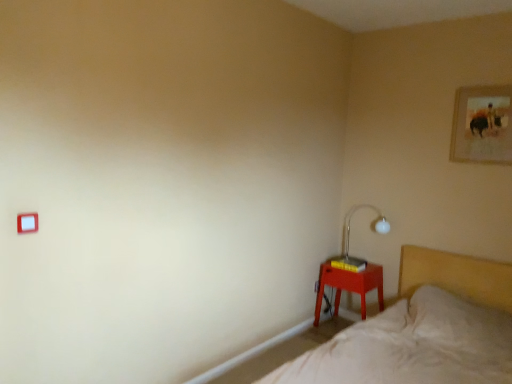
I want to click on beige fabric bed at lower right, so click(x=423, y=329).

What is the approximate height of white plastic light switch at upper left?

white plastic light switch at upper left is 3.26 inches in height.

This screenshot has height=384, width=512. What do you see at coordinates (349, 238) in the screenshot? I see `white glass table lamp at right` at bounding box center [349, 238].

At what (x,y) coordinates should I click in order to perform the action: click on beige fabric bed at lower right. Please return your answer as a coordinate pair (x, y). The width and height of the screenshot is (512, 384). Looking at the image, I should click on (423, 329).

Does gold-framed picture at upper right have a lesser width compared to white glass table lamp at right?

Yes.

Does gold-framed picture at upper right have a smaller size compared to white glass table lamp at right?

Yes.

Is white glass table lamp at right oriented towards beige fabric bed at lower right?

No, white glass table lamp at right is not turned towards beige fabric bed at lower right.

Between white glass table lamp at right and beige fabric bed at lower right, which one has larger size?

With larger size is beige fabric bed at lower right.

From the image's perspective, which is below, white glass table lamp at right or beige fabric bed at lower right?

beige fabric bed at lower right appears lower in the image.

From a real-world perspective, is white glass table lamp at right physically located above or below beige fabric bed at lower right?

white glass table lamp at right is above beige fabric bed at lower right.

Can you confirm if gold-framed picture at upper right is wider than white plastic light switch at upper left?

Yes, gold-framed picture at upper right is wider than white plastic light switch at upper left.

Does gold-framed picture at upper right contain white plastic light switch at upper left?

No, white plastic light switch at upper left is not surrounded by gold-framed picture at upper right.

From their relative heights in the image, would you say gold-framed picture at upper right is taller or shorter than white plastic light switch at upper left?

Clearly, gold-framed picture at upper right is taller compared to white plastic light switch at upper left.

Are white glass table lamp at right and matte plastic nightstand at lower right far apart?

That's not correct — white glass table lamp at right is a little close to matte plastic nightstand at lower right.

You are a GUI agent. You are given a task and a screenshot of the screen. Output one action in this format:
    pyautogui.click(x=<x>, y=<y>)
    Task: Click on the table lamp above the matte plastic nightstand at lower right (from the image's perspective)
    
    Given the screenshot: What is the action you would take?
    pyautogui.click(x=349, y=238)

Who is taller, white glass table lamp at right or matte plastic nightstand at lower right?

matte plastic nightstand at lower right.

Considering the positions of objects white glass table lamp at right and matte plastic nightstand at lower right in the image provided, who is more to the right, white glass table lamp at right or matte plastic nightstand at lower right?

white glass table lamp at right.

Find the location of a particular element. The image size is (512, 384). light switch on the left of white glass table lamp at right is located at coordinates (27, 223).

Is white glass table lamp at right located within white plastic light switch at upper left?

No, white glass table lamp at right is not a part of white plastic light switch at upper left.

Does white plastic light switch at upper left come behind white glass table lamp at right?

No, the depth of white plastic light switch at upper left is less than that of white glass table lamp at right.

Which is more to the right, white plastic light switch at upper left or white glass table lamp at right?

Answer: Positioned to the right is white glass table lamp at right.

Can you see gold-framed picture at upper right touching beige fabric bed at lower right?

gold-framed picture at upper right and beige fabric bed at lower right are clearly separated.

Between gold-framed picture at upper right and beige fabric bed at lower right, which one appears on the right side from the viewer's perspective?

Positioned to the right is gold-framed picture at upper right.

How different are the orientations of gold-framed picture at upper right and beige fabric bed at lower right in degrees?

0.00525 degrees.

Between gold-framed picture at upper right and beige fabric bed at lower right, which one is positioned behind?

gold-framed picture at upper right is behind.

Between white glass table lamp at right and gold-framed picture at upper right, which one appears on the right side from the viewer's perspective?

From the viewer's perspective, gold-framed picture at upper right appears more on the right side.

From a real-world perspective, is white glass table lamp at right below gold-framed picture at upper right?

Yes, from a real-world perspective, white glass table lamp at right is under gold-framed picture at upper right.

Which point is more forward, (348, 230) or (483, 154)?

The point (483, 154) is closer to the camera.

Is white glass table lamp at right smaller than gold-framed picture at upper right?

No.

Where is `table lamp below the gold-framed picture at upper right (from the image's perspective)`? table lamp below the gold-framed picture at upper right (from the image's perspective) is located at coordinates (349, 238).

At what (x,y) coordinates should I click in order to perform the action: click on table lamp located behind the beige fabric bed at lower right. Please return your answer as a coordinate pair (x, y). Looking at the image, I should click on (349, 238).

Which object lies nearer to the anchor point matte plastic nightstand at lower right, beige fabric bed at lower right or white plastic light switch at upper left?

beige fabric bed at lower right is closer to matte plastic nightstand at lower right.

Which object lies further to the anchor point white glass table lamp at right, matte plastic nightstand at lower right or beige fabric bed at lower right?

beige fabric bed at lower right is further to white glass table lamp at right.

When comparing their distances from beige fabric bed at lower right, does matte plastic nightstand at lower right or white glass table lamp at right seem closer?

matte plastic nightstand at lower right is positioned closer to the anchor beige fabric bed at lower right.

Considering their positions, is white glass table lamp at right positioned further to white plastic light switch at upper left than beige fabric bed at lower right?

white glass table lamp at right is positioned further to the anchor white plastic light switch at upper left.

When comparing their distances from white glass table lamp at right, does gold-framed picture at upper right or beige fabric bed at lower right seem further?

The object further to white glass table lamp at right is gold-framed picture at upper right.

Consider the image. From the image, which object appears to be farther from white plastic light switch at upper left, beige fabric bed at lower right or matte plastic nightstand at lower right?

Based on the image, matte plastic nightstand at lower right appears to be further to white plastic light switch at upper left.

Based on their spatial positions, is white glass table lamp at right or gold-framed picture at upper right further from beige fabric bed at lower right?

The object further to beige fabric bed at lower right is gold-framed picture at upper right.

Estimate the real-world distances between objects in this image. Which object is further from white plastic light switch at upper left, matte plastic nightstand at lower right or gold-framed picture at upper right?

The object further to white plastic light switch at upper left is gold-framed picture at upper right.

Image resolution: width=512 pixels, height=384 pixels. Identify the location of light switch between beige fabric bed at lower right and white glass table lamp at right in the front-back direction. (27, 223).

Locate an element on the screen. Image resolution: width=512 pixels, height=384 pixels. bed located between white plastic light switch at upper left and gold-framed picture at upper right in the left-right direction is located at coordinates (423, 329).

The width and height of the screenshot is (512, 384). In order to click on nightstand between beige fabric bed at lower right and white glass table lamp at right in the front-back direction in this screenshot , I will do `click(349, 286)`.

Locate an element on the screen. picture frame positioned between beige fabric bed at lower right and white glass table lamp at right from near to far is located at coordinates (482, 125).